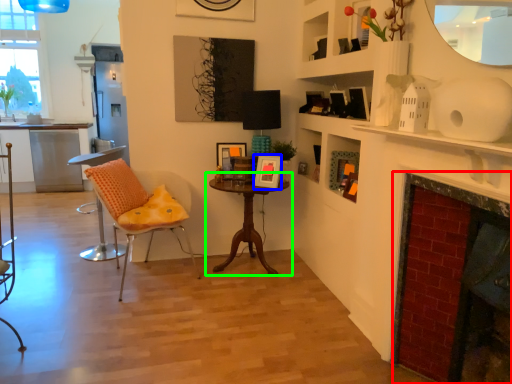
Question: Which object is positioned closest to fireplace (highlighted by a red box)? Select from picture frame (highlighted by a blue box) and table (highlighted by a green box).

Choices:
 (A) picture frame
 (B) table

Answer: (A)